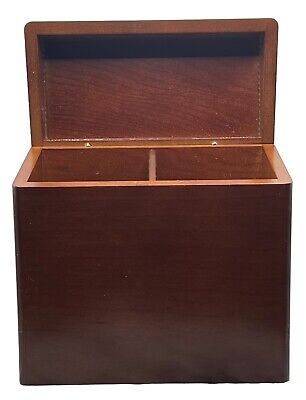
The image size is (306, 400). What are the coordinates of `left hinge` in the screenshot? It's located at (87, 143).